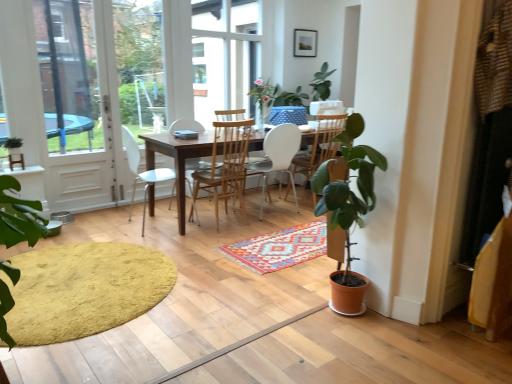
Question: Is white plastic chair at center, which is the 3th chair from right to left, shorter than white glass door at left?

Choices:
 (A) yes
 (B) no

Answer: (A)

Question: Can you confirm if white plastic chair at center, which is the 3th chair from right to left, is taller than white glass door at left?

Choices:
 (A) yes
 (B) no

Answer: (B)

Question: Is white plastic chair at center, which is the 3th chair from right to left, at the left side of white glass door at left?

Choices:
 (A) yes
 (B) no

Answer: (B)

Question: Is white plastic chair at center, which is the 3th chair from right to left, far from white glass door at left?

Choices:
 (A) yes
 (B) no

Answer: (B)

Question: Is white plastic chair at center, the first chair viewed from the left, positioned behind white glass door at left?

Choices:
 (A) no
 (B) yes

Answer: (A)

Question: Based on their positions, is green matte plant at left located to the left or right of white glass door at left?

Choices:
 (A) right
 (B) left

Answer: (B)

Question: Which is correct: green matte plant at left is inside white glass door at left, or outside of it?

Choices:
 (A) inside
 (B) outside

Answer: (B)

Question: In terms of size, does green matte plant at left appear bigger or smaller than white glass door at left?

Choices:
 (A) big
 (B) small

Answer: (B)

Question: In the image, is green matte plant at left positioned in front of or behind white glass door at left?

Choices:
 (A) front
 (B) behind

Answer: (A)

Question: Is white plastic chair at center, the 3th chair from the left, inside or outside of multicolored woven rug at center, the 2th doormat when ordered from left to right?

Choices:
 (A) outside
 (B) inside

Answer: (A)

Question: From the image's perspective, is white plastic chair at center, positioned as the first chair in right-to-left order, located above or below multicolored woven rug at center, the 2th doormat when ordered from left to right?

Choices:
 (A) below
 (B) above

Answer: (B)

Question: Based on their sizes in the image, would you say white plastic chair at center, the 3th chair from the left, is bigger or smaller than multicolored woven rug at center, the 1th doormat viewed from the right?

Choices:
 (A) small
 (B) big

Answer: (B)

Question: In the image, is white plastic chair at center, the 3th chair from the left, positioned in front of or behind multicolored woven rug at center, the 1th doormat viewed from the right?

Choices:
 (A) front
 (B) behind

Answer: (B)

Question: Do you think wooden table at center is within matte black picture frame at upper center, or outside of it?

Choices:
 (A) inside
 (B) outside

Answer: (B)

Question: Considering the positions of wooden table at center and matte black picture frame at upper center in the image, is wooden table at center taller or shorter than matte black picture frame at upper center?

Choices:
 (A) tall
 (B) short

Answer: (A)